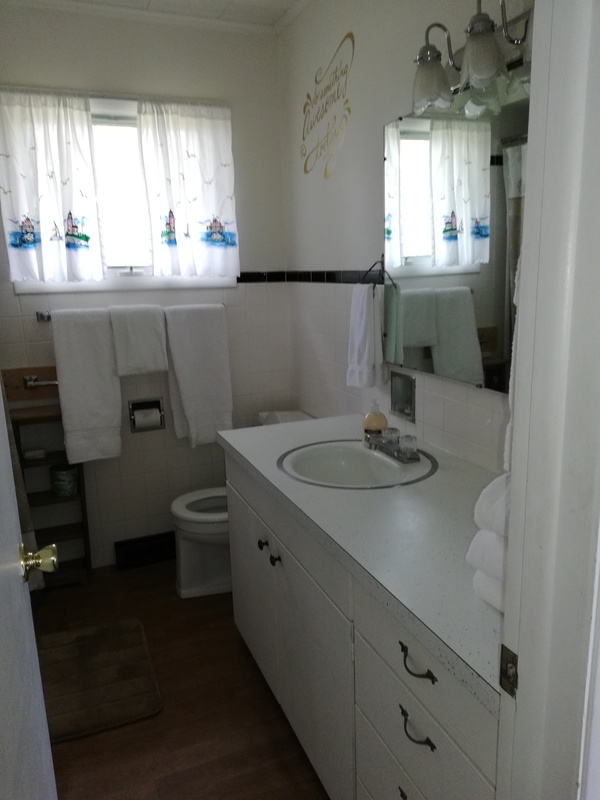
Where is `toilet`? toilet is located at coordinates (200, 538).